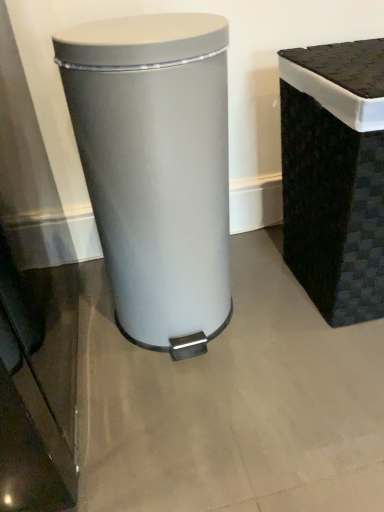
Question: Is black woven basket at right, which is the 2th waste container from left to right, in front of or behind satin silver trash can at center, the 2th waste container from the right, in the image?

Choices:
 (A) front
 (B) behind

Answer: (B)

Question: From the image's perspective, relative to satin silver trash can at center, the 2th waste container from the right, is black woven basket at right, which is the first waste container in right-to-left order, above or below?

Choices:
 (A) above
 (B) below

Answer: (A)

Question: Is black woven basket at right, which is the 2th waste container from left to right, situated inside satin silver trash can at center, which is the first waste container in left-to-right order, or outside?

Choices:
 (A) inside
 (B) outside

Answer: (B)

Question: Relative to black woven basket at right, which is the first waste container in right-to-left order, is satin silver trash can at center, the 2th waste container from the right, in front or behind?

Choices:
 (A) behind
 (B) front

Answer: (B)

Question: Looking at their shapes, would you say satin silver trash can at center, the 2th waste container from the right, is wider or thinner than black woven basket at right, which is the first waste container in right-to-left order?

Choices:
 (A) wide
 (B) thin

Answer: (B)

Question: From the image's perspective, relative to black woven basket at right, which is the first waste container in right-to-left order, is satin silver trash can at center, which is the first waste container in left-to-right order, above or below?

Choices:
 (A) above
 (B) below

Answer: (B)

Question: From their relative heights in the image, would you say satin silver trash can at center, which is the first waste container in left-to-right order, is taller or shorter than black woven basket at right, which is the first waste container in right-to-left order?

Choices:
 (A) short
 (B) tall

Answer: (B)